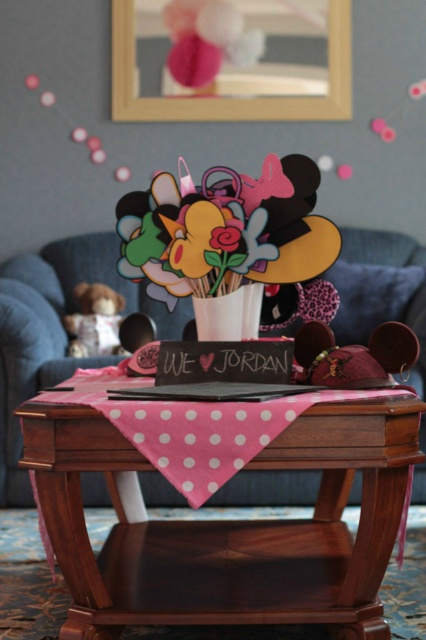
What are the coordinates of the wooden table at center?

The wooden table at center is located at coordinates point (227, 525).

You are a guest entering the living room and want to place a small gift on the wooden table at center. However, you are sitting on the matte pink fabric armchair at center. Can you comfortably reach the table from your seated position?

The wooden table at center has a lesser height compared to matte pink fabric armchair at center. Since the table is lower than the chair, you might find it difficult to comfortably reach the table while seated on the matte pink fabric armchair at center.

Consider the image. You are sitting on the matte pink fabric armchair at center and want to place a book on the wooden table at center. Which direction should you move to reach the table?

The wooden table at center is on the right side of the matte pink fabric armchair at center, so you should move to your right to reach the table.